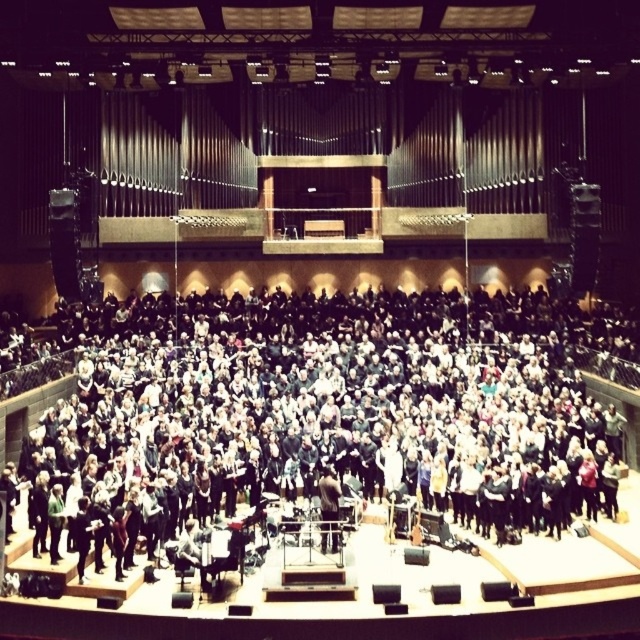
Question: Does black fabric at center have a larger size compared to dark brown leather jacket at center?

Choices:
 (A) yes
 (B) no

Answer: (A)

Question: Which point is closer to the camera?

Choices:
 (A) black fabric at center
 (B) dark brown leather jacket at center

Answer: (A)

Question: Which point is closer to the camera taking this photo?

Choices:
 (A) (323, 488)
 (B) (337, 392)

Answer: (A)

Question: Can you confirm if black fabric at center is thinner than dark brown leather jacket at center?

Choices:
 (A) no
 (B) yes

Answer: (A)

Question: Among these points, which one is farthest from the camera?

Choices:
 (A) (481, 388)
 (B) (324, 483)

Answer: (A)

Question: Observing the image, what is the correct spatial positioning of black fabric at center in reference to dark brown leather jacket at center?

Choices:
 (A) below
 (B) above

Answer: (B)